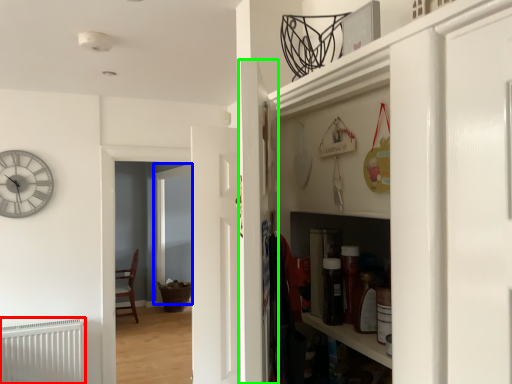
Question: Which object is positioned farthest from radiator (highlighted by a red box)? Select from glass door (highlighted by a blue box) and door (highlighted by a green box).

Choices:
 (A) glass door
 (B) door

Answer: (A)